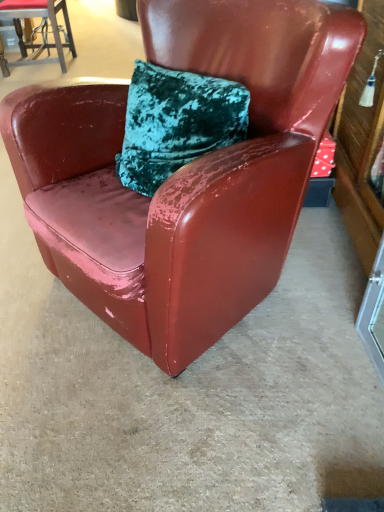
Locate an element on the screen. glossy leather chair at center, the 1th chair when ordered from bottom to top is located at coordinates (184, 172).

What do you see at coordinates (39, 26) in the screenshot? I see `glossy leather chair at upper left, the 2th chair when ordered from front to back` at bounding box center [39, 26].

At what (x,y) coordinates should I click in order to perform the action: click on glossy leather chair at center, acting as the 1th chair starting from the front. Please return your answer as a coordinate pair (x, y). The height and width of the screenshot is (512, 384). Looking at the image, I should click on (184, 172).

From a real-world perspective, is glossy leather chair at upper left, the 2th chair when ordered from bottom to top, on top of transparent glass door at lower right?

Indeed, from a real-world perspective, glossy leather chair at upper left, the 2th chair when ordered from bottom to top, stands above transparent glass door at lower right.

From the image's perspective, is glossy leather chair at upper left, marked as the 2th chair in a right-to-left arrangement, located beneath transparent glass door at lower right?

No, from the image's perspective, glossy leather chair at upper left, marked as the 2th chair in a right-to-left arrangement, is not below transparent glass door at lower right.

Is glossy leather chair at upper left, the first chair in the left-to-right sequence, not close to transparent glass door at lower right?

Yes, glossy leather chair at upper left, the first chair in the left-to-right sequence, is far from transparent glass door at lower right.

How distant is glossy leather chair at upper left, the 2th chair when ordered from front to back, from transparent glass door at lower right?

glossy leather chair at upper left, the 2th chair when ordered from front to back, is 3.18 meters away from transparent glass door at lower right.

Is glossy leather chair at center, arranged as the 2th chair when viewed from the left, located outside glossy leather chair at upper left, the 2th chair when ordered from front to back?

Yes.

Who is shorter, glossy leather chair at center, acting as the 2th chair starting from the back, or glossy leather chair at upper left, the 2th chair when ordered from bottom to top?

Standing shorter between the two is glossy leather chair at upper left, the 2th chair when ordered from bottom to top.

Based on their sizes in the image, would you say glossy leather chair at center, which is counted as the 1th chair, starting from the right, is bigger or smaller than glossy leather chair at upper left, marked as the 2th chair in a right-to-left arrangement?

Considering their sizes, glossy leather chair at center, which is counted as the 1th chair, starting from the right, takes up more space than glossy leather chair at upper left, marked as the 2th chair in a right-to-left arrangement.

Who is more distant, glossy leather chair at center, the 2th chair when ordered from top to bottom, or glossy leather chair at upper left, which is the 1th chair from top to bottom?

glossy leather chair at upper left, which is the 1th chair from top to bottom, is further from the camera.

Is glossy leather chair at center, acting as the 1th chair starting from the front, positioned with its back to transparent glass door at lower right?

No, glossy leather chair at center, acting as the 1th chair starting from the front,'s orientation is not away from transparent glass door at lower right.

Between glossy leather chair at center, acting as the 2th chair starting from the back, and transparent glass door at lower right, which one is positioned behind?

transparent glass door at lower right.

From the image's perspective, is glossy leather chair at center, which is counted as the 1th chair, starting from the right, above or below transparent glass door at lower right?

Based on their image positions, glossy leather chair at center, which is counted as the 1th chair, starting from the right, is located above transparent glass door at lower right.

Is glossy leather chair at center, the 2th chair when ordered from top to bottom, bigger or smaller than transparent glass door at lower right?

Considering their sizes, glossy leather chair at center, the 2th chair when ordered from top to bottom, takes up more space than transparent glass door at lower right.

Locate an element on the screen. This screenshot has width=384, height=512. chair on the right of the glossy leather chair at upper left, the first chair in the left-to-right sequence is located at coordinates (184, 172).

Is glossy leather chair at upper left, which is the 1th chair from top to bottom, not near glossy leather chair at center, which is counted as the 1th chair, starting from the right?

glossy leather chair at upper left, which is the 1th chair from top to bottom, is far away from glossy leather chair at center, which is counted as the 1th chair, starting from the right.

From the image's perspective, relative to glossy leather chair at center, the 2th chair when ordered from top to bottom, is glossy leather chair at upper left, which is the 1th chair from top to bottom, above or below?

glossy leather chair at upper left, which is the 1th chair from top to bottom, is above glossy leather chair at center, the 2th chair when ordered from top to bottom.

Between glossy leather chair at upper left, marked as the 2th chair in a right-to-left arrangement, and glossy leather chair at center, arranged as the 2th chair when viewed from the left, which one appears on the right side from the viewer's perspective?

glossy leather chair at center, arranged as the 2th chair when viewed from the left, is more to the right.

From the image's perspective, is transparent glass door at lower right on top of glossy leather chair at center, acting as the 1th chair starting from the front?

No, from the image's perspective, transparent glass door at lower right is not over glossy leather chair at center, acting as the 1th chair starting from the front.

From a real-world perspective, is transparent glass door at lower right physically below glossy leather chair at center, which is counted as the 1th chair, starting from the right?

Yes, from a real-world perspective, transparent glass door at lower right is beneath glossy leather chair at center, which is counted as the 1th chair, starting from the right.

Is transparent glass door at lower right looking in the opposite direction of glossy leather chair at upper left, the 2th chair when ordered from front to back?

No.

Are transparent glass door at lower right and glossy leather chair at upper left, the first chair in the left-to-right sequence, located far from each other?

Yes, transparent glass door at lower right and glossy leather chair at upper left, the first chair in the left-to-right sequence, are quite far apart.

Which is behind, transparent glass door at lower right or glossy leather chair at upper left, the 2th chair when ordered from bottom to top?

glossy leather chair at upper left, the 2th chair when ordered from bottom to top.

From the image's perspective, starting from the transparent glass door at lower right, which chair is the 2nd one above? Please provide its 2D coordinates.

[(39, 26)]

Locate an element on the screen. The height and width of the screenshot is (512, 384). chair on the left of glossy leather chair at center, acting as the 2th chair starting from the back is located at coordinates (39, 26).

Which object lies nearer to the anchor point glossy leather chair at upper left, which is the 1th chair from top to bottom, transparent glass door at lower right or glossy leather chair at center, the 1th chair when ordered from bottom to top?

glossy leather chair at center, the 1th chair when ordered from bottom to top, lies closer to glossy leather chair at upper left, which is the 1th chair from top to bottom, than the other object.

Estimate the real-world distances between objects in this image. Which object is closer to transparent glass door at lower right, glossy leather chair at center, the 1th chair when ordered from bottom to top, or glossy leather chair at upper left, the 2th chair when ordered from front to back?

glossy leather chair at center, the 1th chair when ordered from bottom to top, lies closer to transparent glass door at lower right than the other object.

Consider the image. Which object lies nearer to the anchor point transparent glass door at lower right, glossy leather chair at upper left, the first chair in the back-to-front sequence, or glossy leather chair at center, which is counted as the 1th chair, starting from the right?

glossy leather chair at center, which is counted as the 1th chair, starting from the right, is positioned closer to the anchor transparent glass door at lower right.

Which object lies nearer to the anchor point glossy leather chair at center, acting as the 1th chair starting from the front, glossy leather chair at upper left, the first chair in the back-to-front sequence, or transparent glass door at lower right?

Among the two, transparent glass door at lower right is located nearer to glossy leather chair at center, acting as the 1th chair starting from the front.

From the image, which object appears to be farther from glossy leather chair at upper left, the 2th chair when ordered from bottom to top, glossy leather chair at center, arranged as the 2th chair when viewed from the left, or transparent glass door at lower right?

Based on the image, transparent glass door at lower right appears to be further to glossy leather chair at upper left, the 2th chair when ordered from bottom to top.

From the image, which object appears to be farther from glossy leather chair at center, the 2th chair when ordered from top to bottom, transparent glass door at lower right or glossy leather chair at upper left, the 2th chair when ordered from bottom to top?

The object further to glossy leather chair at center, the 2th chair when ordered from top to bottom, is glossy leather chair at upper left, the 2th chair when ordered from bottom to top.

You are a GUI agent. You are given a task and a screenshot of the screen. Output one action in this format:
    pyautogui.click(x=<x>, y=<y>)
    Task: Click on the glass door located between glossy leather chair at center, acting as the 2th chair starting from the back, and glossy leather chair at upper left, marked as the 2th chair in a right-to-left arrangement, in the depth direction
    This screenshot has height=512, width=384.
    Given the screenshot: What is the action you would take?
    pyautogui.click(x=374, y=312)